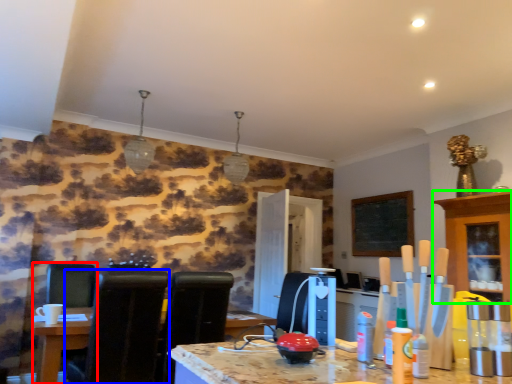
Question: Which object is the closest to the chair (highlighted by a red box)? Choose among these: chair (highlighted by a blue box) or cabinetry (highlighted by a green box).

Choices:
 (A) chair
 (B) cabinetry

Answer: (A)